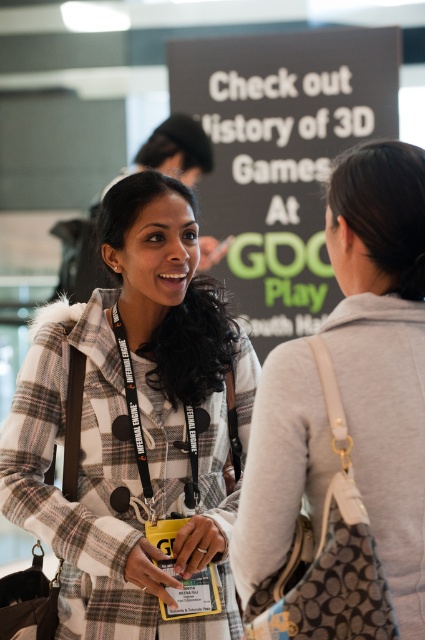
Question: Is plaid wool coat at center smaller than black matte signboard at upper center?

Choices:
 (A) yes
 (B) no

Answer: (A)

Question: Which point appears farthest from the camera in this image?

Choices:
 (A) (387, 90)
 (B) (263, 385)

Answer: (A)

Question: Is plaid wool coat at center further to the viewer compared to black matte signboard at upper center?

Choices:
 (A) no
 (B) yes

Answer: (A)

Question: Which of the following is the closest to the observer?

Choices:
 (A) (391, 115)
 (B) (384, 436)

Answer: (B)

Question: Which object is farther from the camera taking this photo?

Choices:
 (A) gray fabric hoodie at upper right
 (B) black matte signboard at upper center
 (C) plaid wool coat at center

Answer: (B)

Question: Is plaid wool coat at center below black matte signboard at upper center?

Choices:
 (A) yes
 (B) no

Answer: (A)